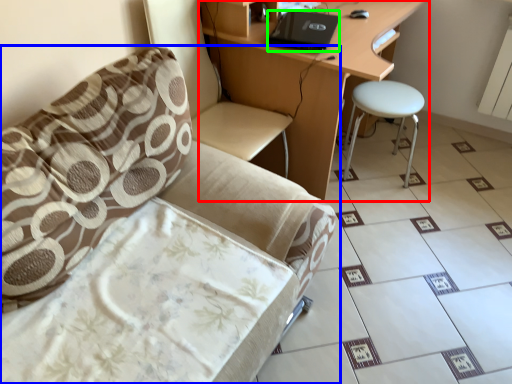
Question: Based on their relative distances, which object is nearer to desk (highlighted by a red box)? Choose from chair (highlighted by a blue box) and laptop (highlighted by a green box).

Choices:
 (A) chair
 (B) laptop

Answer: (B)